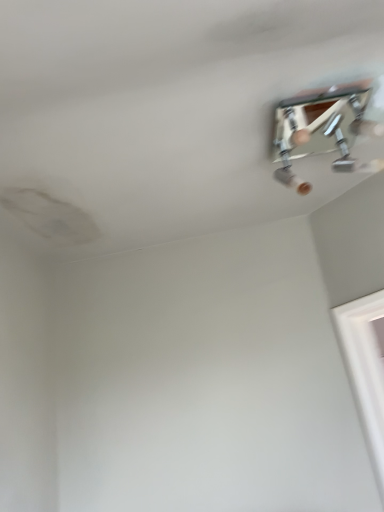
In order to face metallic chrome light fixture at upper right, should I rotate leftwards or rightwards?

To align with it, rotate right about 18.388°.

Describe the element at coordinates (322, 130) in the screenshot. I see `metallic chrome light fixture at upper right` at that location.

Locate an element on the screen. This screenshot has width=384, height=512. metallic chrome light fixture at upper right is located at coordinates (322, 130).

At what (x,y) coordinates should I click in order to perform the action: click on metallic chrome light fixture at upper right. Please return your answer as a coordinate pair (x, y). The width and height of the screenshot is (384, 512). Looking at the image, I should click on (322, 130).